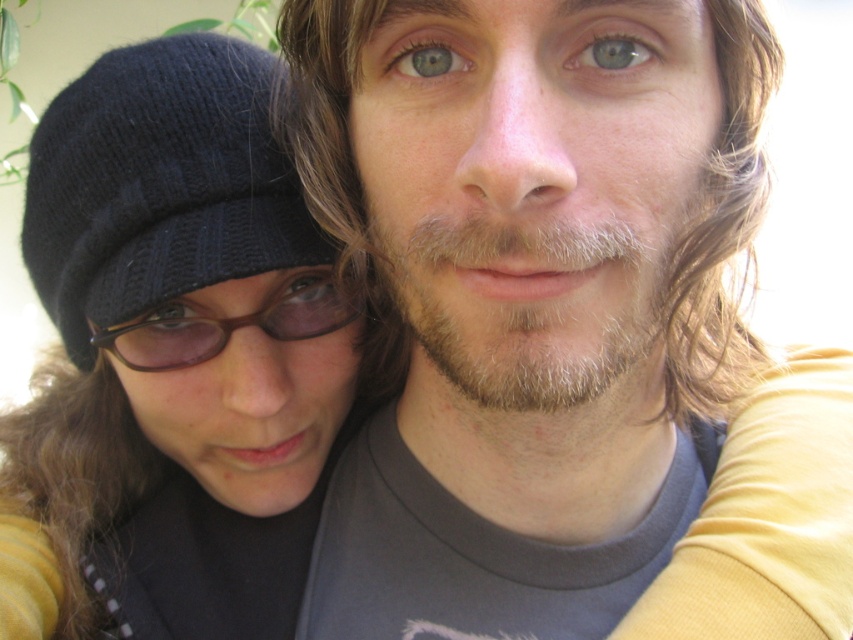
You are trying to take a photo of the black knitted hat at left and the brown matte glasses at center. Which object is positioned closer to the camera?

The black knitted hat at left is closer to the viewer than the brown matte glasses at center, so it is positioned closer to the camera.